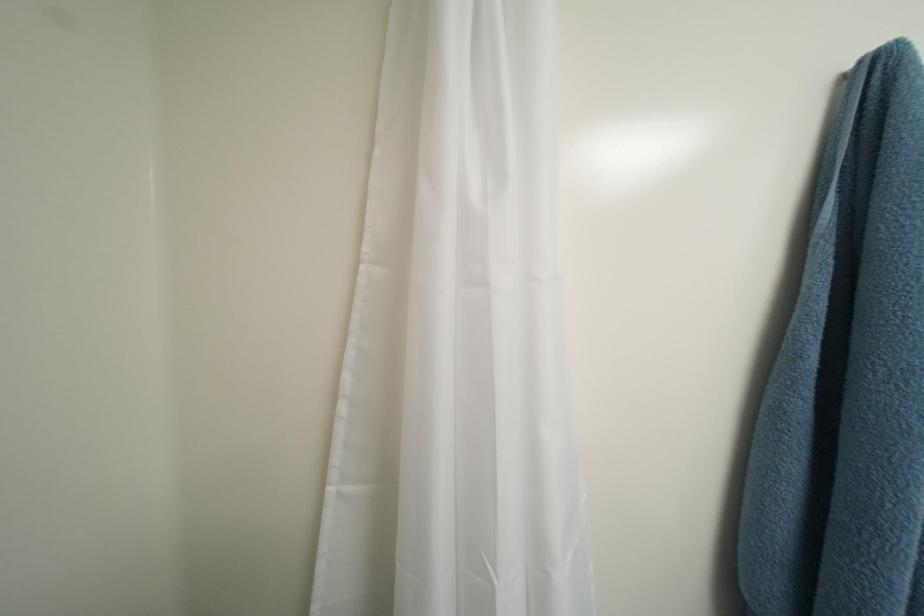
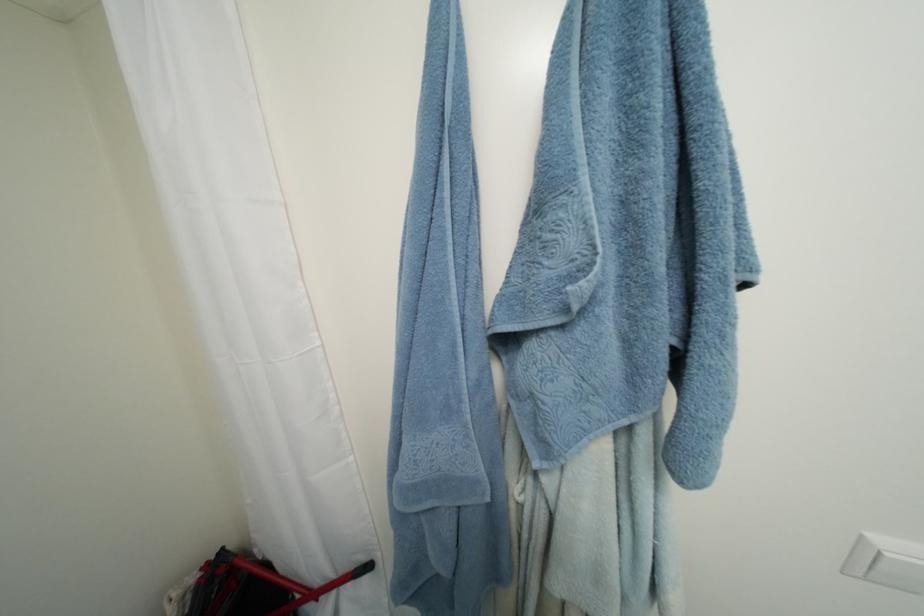
Question: The camera is either moving clockwise (left) or counter-clockwise (right) around the object. The first image is from the beginning of the video and the second image is from the end. Is the camera moving left or right when shooting the video?

Choices:
 (A) Left
 (B) Right

Answer: (B)